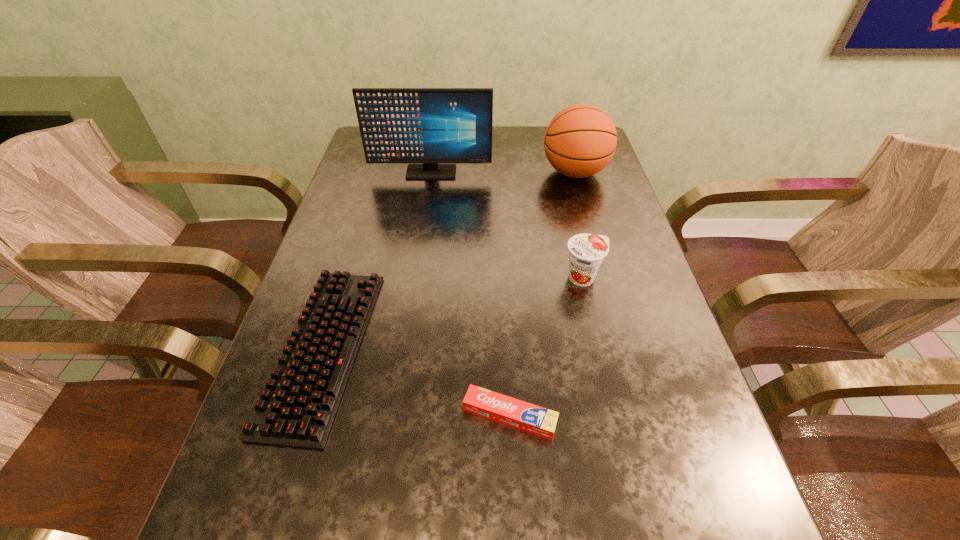
Select which object appears as the closest to the computer monitor. Please provide its 2D coordinates. Your answer should be formatted as a tuple, i.e. [(x, y)], where the tuple contains the x and y coordinates of a point satisfying the conditions above.

[(580, 141)]

This screenshot has width=960, height=540. In order to click on blank space that satisfies the following two spatial constraints: 1. on the back side of the fourth shortest object; 2. on the right side of the computer keyboard in this screenshot , I will do `click(377, 172)`.

Identify the location of vacant area in the image that satisfies the following two spatial constraints: 1. on the screen side of the computer monitor; 2. on the left side of the second tallest object. (431, 172).

Image resolution: width=960 pixels, height=540 pixels. In order to click on vacant space that satisfies the following two spatial constraints: 1. on the back side of the third tallest object; 2. on the right side of the fourth shortest object in this screenshot , I will do `click(559, 172)`.

Identify the location of free space that satisfies the following two spatial constraints: 1. on the screen side of the tallest object; 2. on the left side of the yogurt. The height and width of the screenshot is (540, 960). (416, 278).

This screenshot has height=540, width=960. I want to click on free point that satisfies the following two spatial constraints: 1. on the screen side of the tallest object; 2. on the left side of the toothpaste, so (x=396, y=416).

The image size is (960, 540). Find the location of `free point that satisfies the following two spatial constraints: 1. on the screen side of the fourth shortest object; 2. on the right side of the tallest object`. free point that satisfies the following two spatial constraints: 1. on the screen side of the fourth shortest object; 2. on the right side of the tallest object is located at coordinates (431, 172).